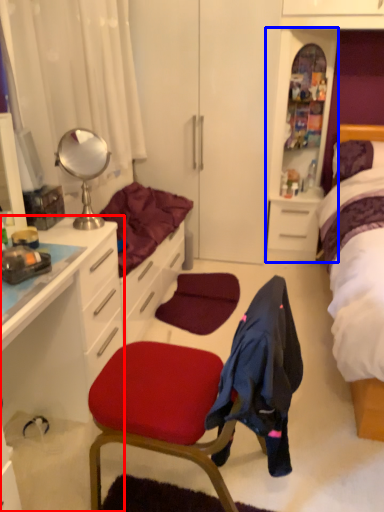
Question: Which object is closer to the camera taking this photo, cabinetry (highlighted by a red box) or file cabinet (highlighted by a blue box)?

Choices:
 (A) cabinetry
 (B) file cabinet

Answer: (A)